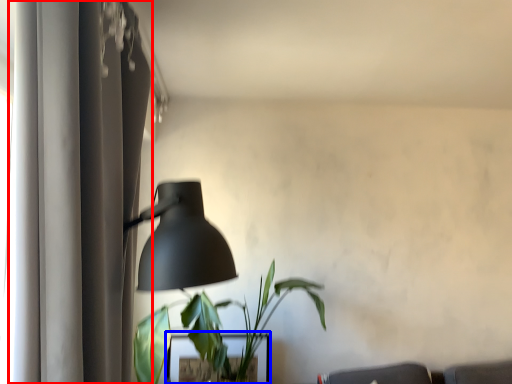
Question: Which of the following is the closest to the observer, curtain (highlighted by a red box) or table (highlighted by a blue box)?

Choices:
 (A) curtain
 (B) table

Answer: (A)